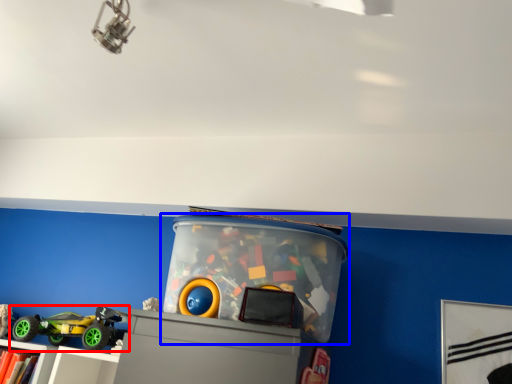
Question: Among these objects, which one is nearest to the camera, toy (highlighted by a red box) or toy (highlighted by a blue box)?

Choices:
 (A) toy
 (B) toy

Answer: (B)